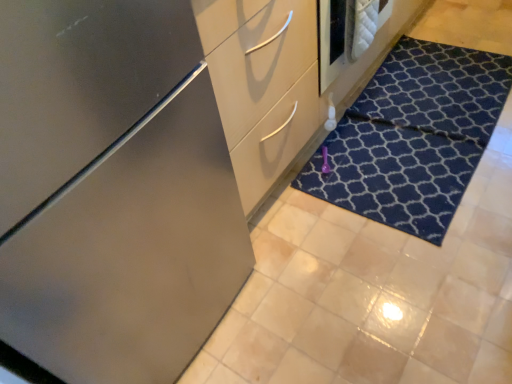
Question: Is satin finish cabinet at center to the left or to the right of dark blue textured doormat at lower right in the image?

Choices:
 (A) right
 (B) left

Answer: (B)

Question: From a real-world perspective, is satin finish cabinet at center physically located above or below dark blue textured doormat at lower right?

Choices:
 (A) below
 (B) above

Answer: (B)

Question: Which object is positioned closest to the dark blue textured doormat at lower right?

Choices:
 (A) satin finish dresser at center
 (B) satin finish cabinet at center

Answer: (A)

Question: Which of these objects is positioned farthest from the satin finish cabinet at center?

Choices:
 (A) dark blue textured doormat at lower right
 (B) satin finish dresser at center

Answer: (A)